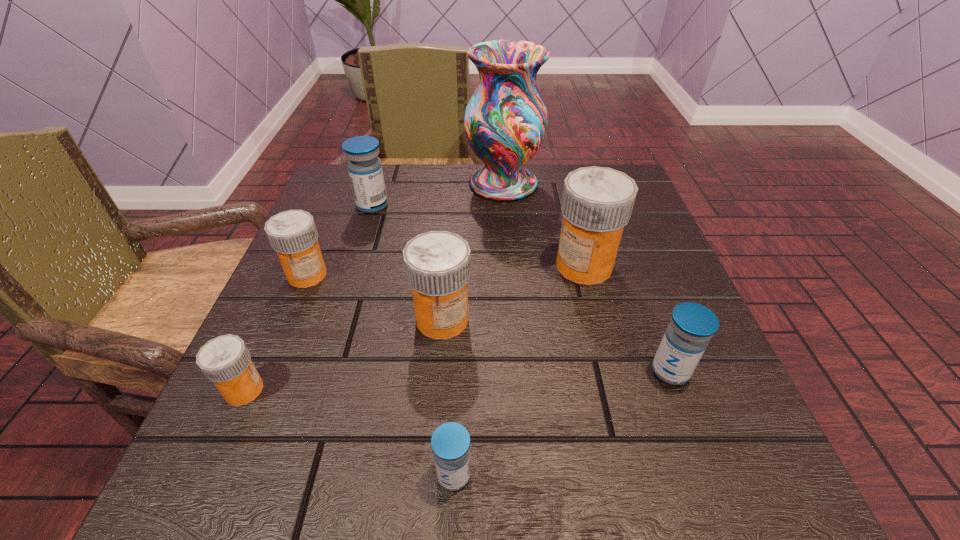
Identify the location of the smallest orange medicine. (225, 360).

You are a GUI agent. You are given a task and a screenshot of the screen. Output one action in this format:
    pyautogui.click(x=<x>, y=<y>)
    Task: Click on the nearest object
    
    Given the screenshot: What is the action you would take?
    pyautogui.click(x=450, y=442)

This screenshot has height=540, width=960. I want to click on the nearest medicine, so click(450, 442).

Image resolution: width=960 pixels, height=540 pixels. I want to click on vacant point located 0.390m on the front of the tallest object, so click(x=515, y=340).

You are a GUI agent. You are given a task and a screenshot of the screen. Output one action in this format:
    pyautogui.click(x=<x>, y=<y>)
    Task: Click on the free space located on the label side of the biggest orange medicine
    This screenshot has height=540, width=960.
    Given the screenshot: What is the action you would take?
    pyautogui.click(x=502, y=266)

Identify the location of vacant space situated 0.250m on the label side of the biggest orange medicine. The height and width of the screenshot is (540, 960). (423, 266).

Find the location of `vacant region located on the label side of the biggest orange medicine`. vacant region located on the label side of the biggest orange medicine is located at coordinates (408, 266).

This screenshot has height=540, width=960. Identify the location of vacant region located on the right of the farthest medicine. (477, 206).

Where is `free space located on the label side of the second biggest orange medicine`? Image resolution: width=960 pixels, height=540 pixels. free space located on the label side of the second biggest orange medicine is located at coordinates (437, 384).

At what (x,y) coordinates should I click in order to perform the action: click on free space located on the label side of the third biggest orange medicine. Please return your answer as a coordinate pair (x, y). Looking at the image, I should click on (214, 496).